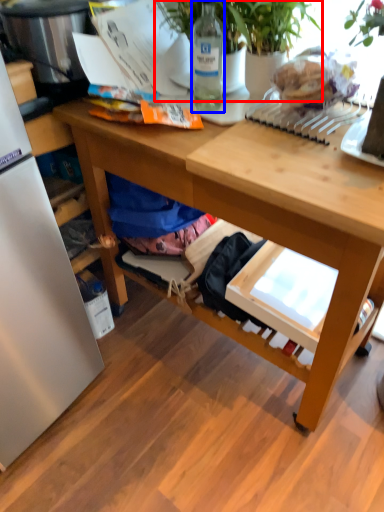
Question: Which object appears closest to the camera in this image, houseplant (highlighted by a red box) or bottle (highlighted by a blue box)?

Choices:
 (A) houseplant
 (B) bottle

Answer: (A)